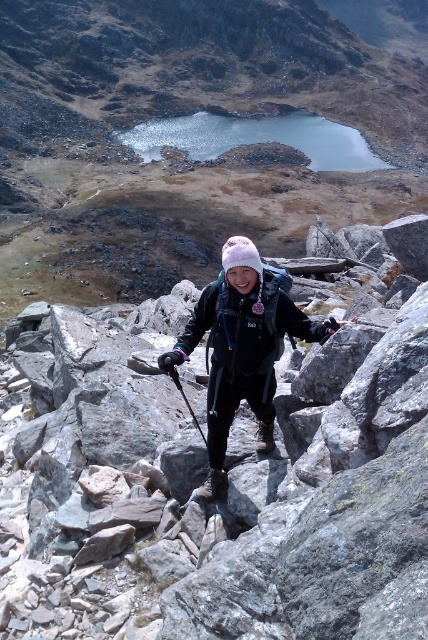
Consider the image. Is matte black backpack at center smaller than matte black jacket at center?

Incorrect, matte black backpack at center is not smaller in size than matte black jacket at center.

Which of these two, matte black backpack at center or matte black jacket at center, stands taller?

With more height is matte black backpack at center.

At what (x,y) coordinates should I click in order to perform the action: click on matte black backpack at center. Please return your answer as a coordinate pair (x, y). This screenshot has width=428, height=640. Looking at the image, I should click on (189, 148).

Based on the photo, is matte black jacket at center above black rubber ski pole at center?

Correct, matte black jacket at center is located above black rubber ski pole at center.

Is matte black jacket at center shorter than black rubber ski pole at center?

No.

Does point (226, 433) come farther from viewer compared to point (202, 436)?

No, it is not.

Where is `matte black jacket at center`? matte black jacket at center is located at coordinates (241, 349).

Between point (264, 356) and point (211, 113), which one is positioned in front?

Positioned in front is point (264, 356).

Who is positioned more to the left, matte black jacket at center or blue glassy lake at upper center?

matte black jacket at center

Locate an element on the screen. matte black jacket at center is located at coordinates (241, 349).

The image size is (428, 640). Identify the location of matte black jacket at center. (241, 349).